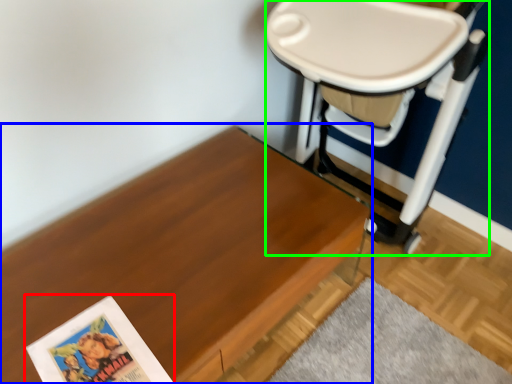
Question: Which object is the farthest from paperback book (highlighted by a red box)? Choose among these: table (highlighted by a blue box) or swivel chair (highlighted by a green box).

Choices:
 (A) table
 (B) swivel chair

Answer: (B)